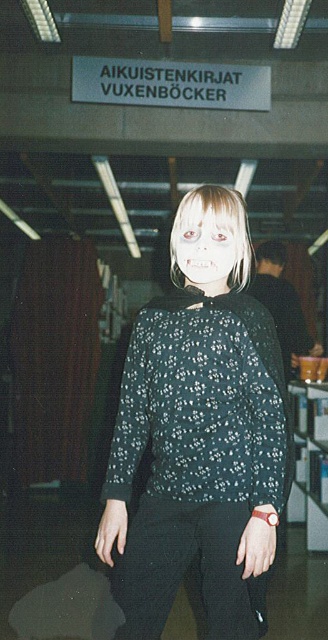
Between black floral blouse at center and white matte face at center, which one is positioned lower?

black floral blouse at center is below.

Which of these two, black floral blouse at center or white matte face at center, stands shorter?

white matte face at center is shorter.

Between point (245, 518) and point (221, 269), which one is positioned in front?

Point (245, 518) is more forward.

Locate an element on the screen. black floral blouse at center is located at coordinates (200, 433).